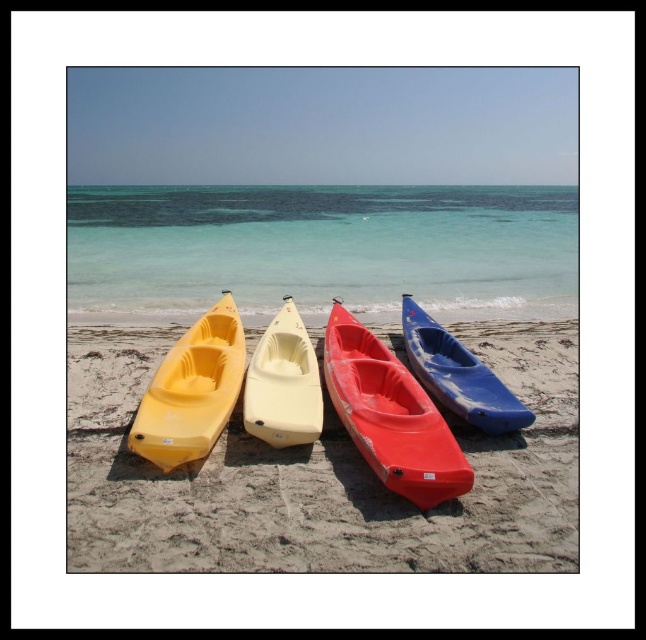
You are standing on the beach looking at the kayaks. There are two points marked on the image. The first point is at coordinates point (110, 250) and the second point is at point (371, 376). Which point is closer to you?

Point (110, 250) is behind point (371, 376), so the second point is closer to you.